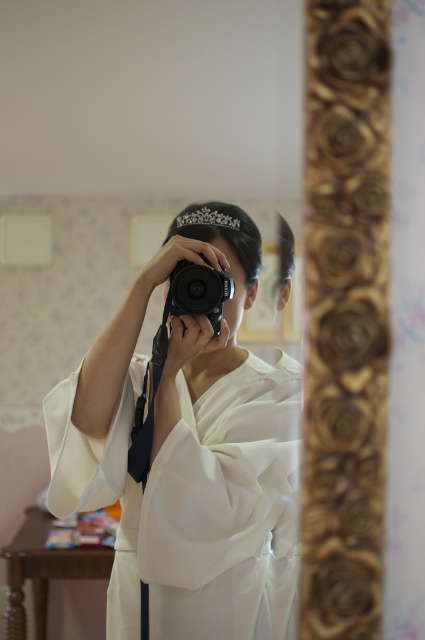
Question: Is white satin kimono at center to the left of black plastic camera at center from the viewer's perspective?

Choices:
 (A) no
 (B) yes

Answer: (B)

Question: In this image, where is white satin kimono at center located relative to black plastic camera at center?

Choices:
 (A) below
 (B) above

Answer: (A)

Question: Which of the following is the closest to the observer?

Choices:
 (A) black plastic camera at center
 (B) white satin kimono at center

Answer: (B)

Question: Which object is closer to the camera taking this photo?

Choices:
 (A) black plastic camera at center
 (B) white satin kimono at center

Answer: (B)

Question: Does white satin kimono at center have a lesser width compared to black plastic camera at center?

Choices:
 (A) no
 (B) yes

Answer: (A)